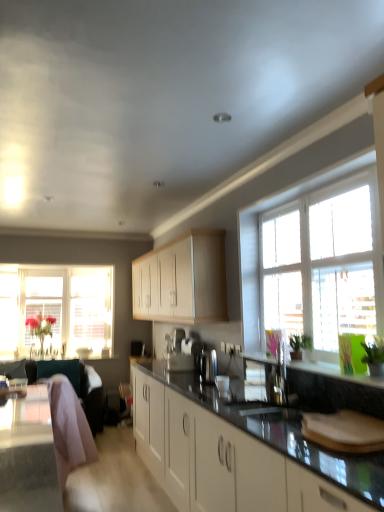
Question: From their relative heights in the image, would you say black glossy countertop at center is taller or shorter than pink fabric swivel chair at lower left, the first swivel chair when ordered from front to back?

Choices:
 (A) short
 (B) tall

Answer: (B)

Question: Is black glossy countertop at center spatially inside pink fabric swivel chair at lower left, arranged as the second swivel chair when viewed from the back, or outside of it?

Choices:
 (A) inside
 (B) outside

Answer: (B)

Question: Which object is the farthest from the pink fabric swivel chair at lower left, the first swivel chair when ordered from front to back?

Choices:
 (A) clear glass window at right, the 2th window in the back-to-front sequence
 (B) wooden table at lower left
 (C) satin silver coffee machine at center
 (D) translucent glass vase at left, the 2th window positioned from the front
 (E) black glossy countertop at center

Answer: (D)

Question: Estimate the real-world distances between objects in this image. Which object is closer to the clear glass window at right, the 2th window in the back-to-front sequence?

Choices:
 (A) satin silver sink at center
 (B) pink fabric swivel chair at lower left, acting as the 2th swivel chair starting from the front
 (C) light wood cabinet at center
 (D) translucent glass vase at left, arranged as the first window when viewed from the back
 (E) satin silver coffee machine at center

Answer: (A)